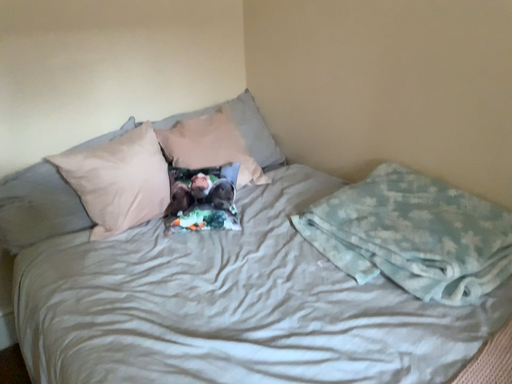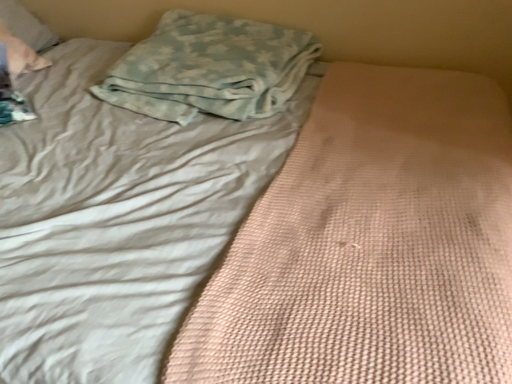
Question: Which way did the camera rotate in the video?

Choices:
 (A) rotated left
 (B) rotated right

Answer: (B)